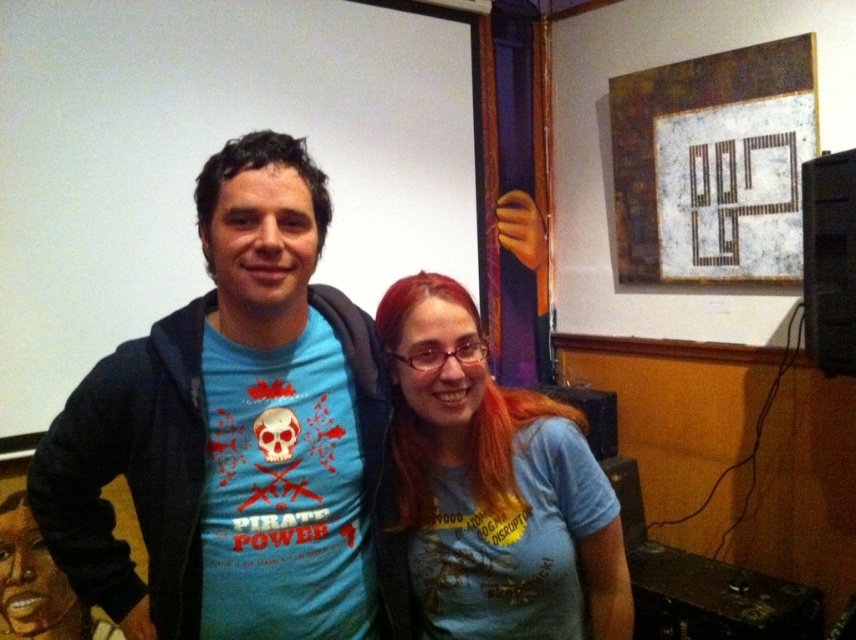
Question: Which point appears closest to the camera in this image?

Choices:
 (A) (206, 196)
 (B) (587, 484)

Answer: (A)

Question: Can you confirm if blue t-shirt at center is thinner than blue cotton shirt at center?

Choices:
 (A) yes
 (B) no

Answer: (B)

Question: Which of the following is the closest to the observer?

Choices:
 (A) (474, 413)
 (B) (360, 513)

Answer: (A)

Question: Does blue t-shirt at center appear under blue cotton shirt at center?

Choices:
 (A) yes
 (B) no

Answer: (B)

Question: Can you confirm if blue t-shirt at center is positioned to the right of blue cotton shirt at center?

Choices:
 (A) no
 (B) yes

Answer: (A)